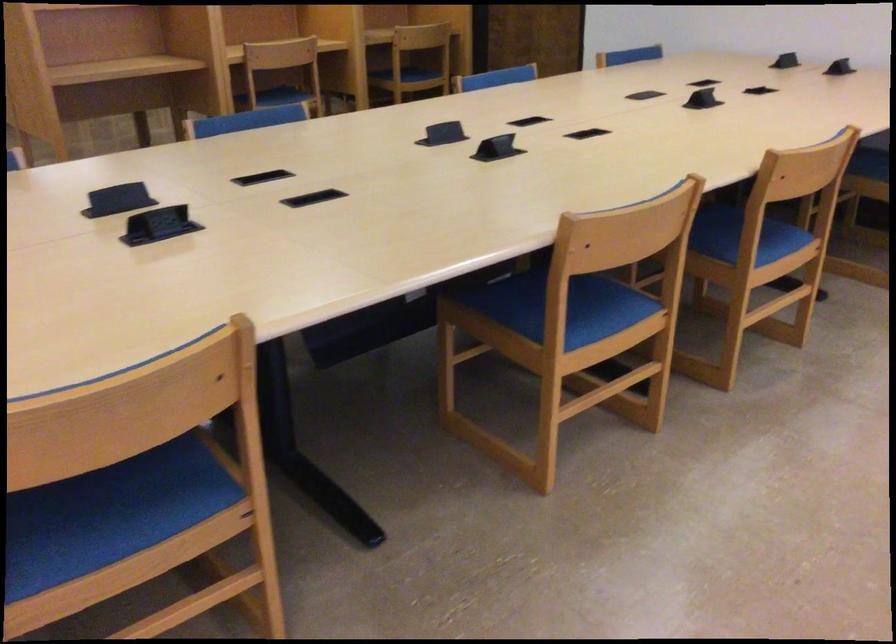
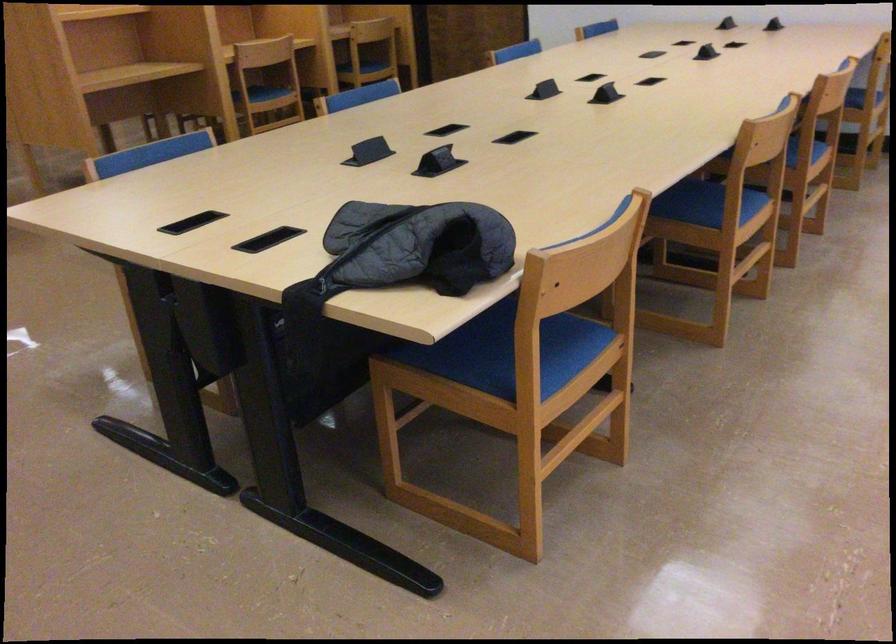
In the second image, find the point that corresponds to (x=546, y=308) in the first image.

(702, 204)